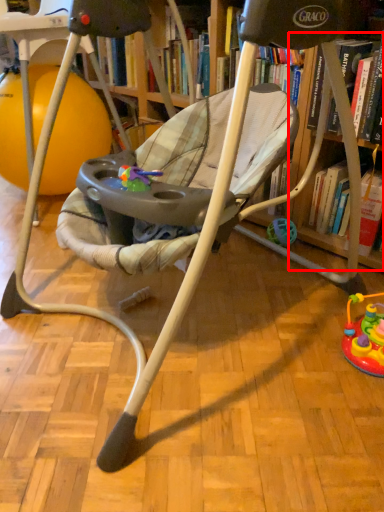
Question: From the image's perspective, where is shelf (annotated by the red box) located in relation to ball in the image?

Choices:
 (A) below
 (B) above

Answer: (A)